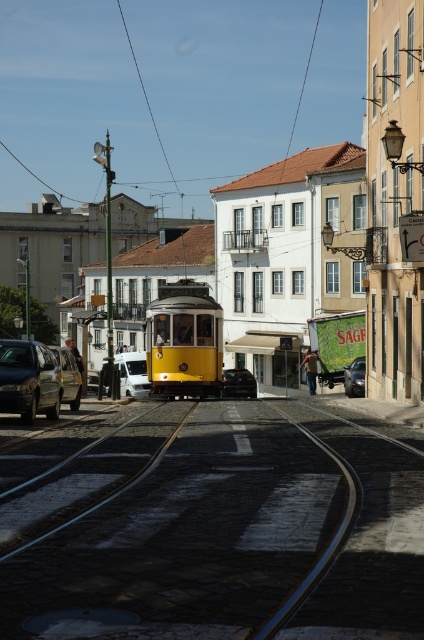
You are a tour guide in Lisbon and need to park your car. You see a matte black car at left and a shiny black sedan at center. The parking spot you want is between them. Can you fit a car that is 5 meters long in that space?

The distance between the matte black car at left and the shiny black sedan at center is 16.95 meters. Since the parking space is 16.95 meters long, which is more than enough to accommodate a 5 meter long car, you can fit your car in the space.

You are a delivery driver who needs to park your vehicle in a tight space between the matte black car at left and the shiny black sedan at center. Your vehicle is 1.8 meters wide. Can you fit your vehicle between them?

The matte black car at left might be wider than the shiny black sedan at center, so it is uncertain if there is enough space to fit a vehicle that is 1.8 meters wide between them. You should measure the gap before attempting to park.